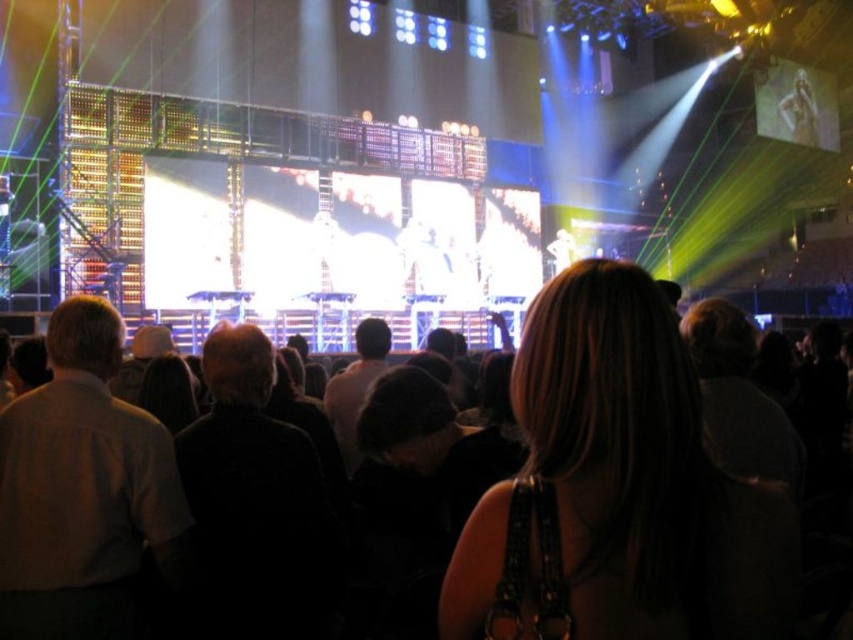
Does light brown shirt at left have a greater width compared to dark hair at center?

Correct, the width of light brown shirt at left exceeds that of dark hair at center.

Who is taller, light brown shirt at left or dark hair at center?

light brown shirt at left is taller.

Where is `light brown shirt at left`? Image resolution: width=853 pixels, height=640 pixels. light brown shirt at left is located at coordinates (84, 492).

Where is `light brown shirt at left`? The height and width of the screenshot is (640, 853). light brown shirt at left is located at coordinates (84, 492).

Does light brown shirt at left have a greater width compared to dark gray sweater at center?

Yes.

Does light brown shirt at left have a greater height compared to dark gray sweater at center?

Yes.

The width and height of the screenshot is (853, 640). I want to click on light brown shirt at left, so click(x=84, y=492).

Identify the location of light brown shirt at left. This screenshot has width=853, height=640. (84, 492).

Is dark gray sweater at center below dark hair at center?

Yes.

Between dark gray sweater at center and dark hair at center, which one has less height?

With less height is dark hair at center.

Between point (219, 346) and point (343, 378), which one is positioned behind?

The point (343, 378) is more distant.

Find the location of a particular element. The height and width of the screenshot is (640, 853). dark gray sweater at center is located at coordinates (256, 500).